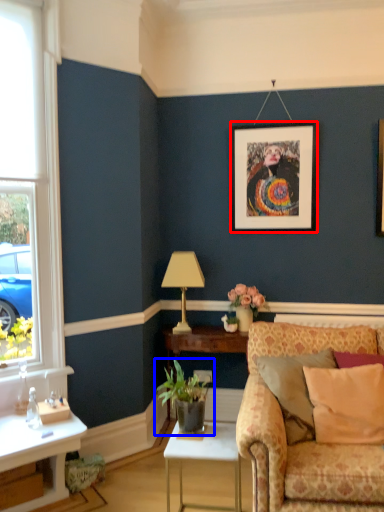
Question: Among these objects, which one is nearest to the camera, picture frame (highlighted by a red box) or houseplant (highlighted by a blue box)?

Choices:
 (A) picture frame
 (B) houseplant

Answer: (B)